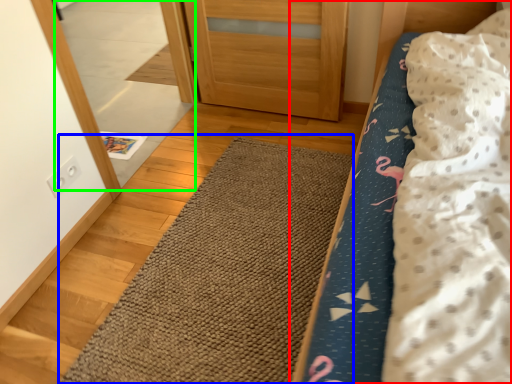
Question: Considering the real-world distances, which object is closest to bed (highlighted by a red box)? doormat (highlighted by a blue box) or mirror (highlighted by a green box).

Choices:
 (A) doormat
 (B) mirror

Answer: (A)